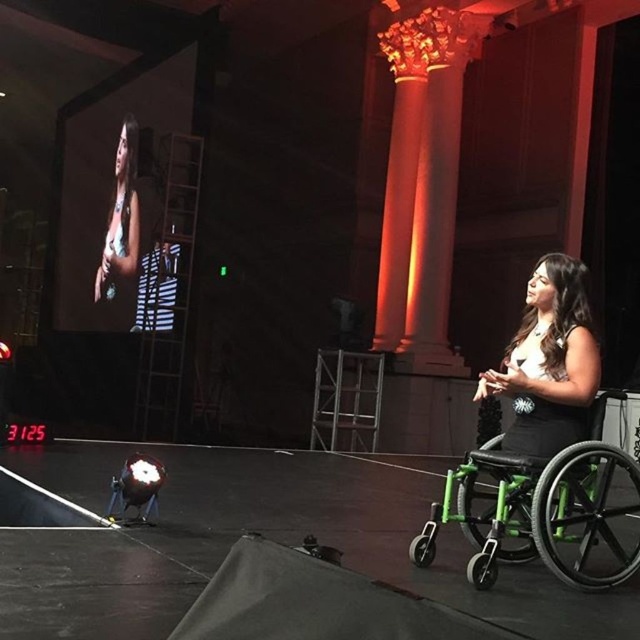
You are a stagehand preparing to adjust the spotlight. You need to move the spotlight from its current position to a position where it can illuminate both the black matte wheelchair at lower right and the matte black dress at upper left without moving the wheelchair or the dress. Is this possible given their current positions?

The black matte wheelchair at lower right is in front of the matte black dress at upper left. Since the wheelchair is closer to the spotlight, adjusting the spotlight to shine past the wheelchair towards the dress might be possible if the angle allows both to be lit simultaneously. However, without moving either object, it depends on the spotlight beam width and angle of the stage setup.

You are an event organizer setting up a stage. You have two wheelchairs available for a presenter who needs seating. The green plastic wheelchair at right and the black matte wheelchair at lower right. Which wheelchair should you choose if you need the one that is wider to accommodate more space for the presenter?

The green plastic wheelchair at right is wider than the black matte wheelchair at lower right, so you should choose the green plastic wheelchair at right for more space.

You are standing at point A with coordinates point A at (532, 499). You need to move to point B, which is 8.69 feet away from you. Can you reach point B without moving through any obstacles?

Yes, you can reach point B without moving through any obstacles because the distance between point A at (532, 499) and point B is 8.69 feet, and there are no obstacles mentioned in the scene description that would block the path between them.